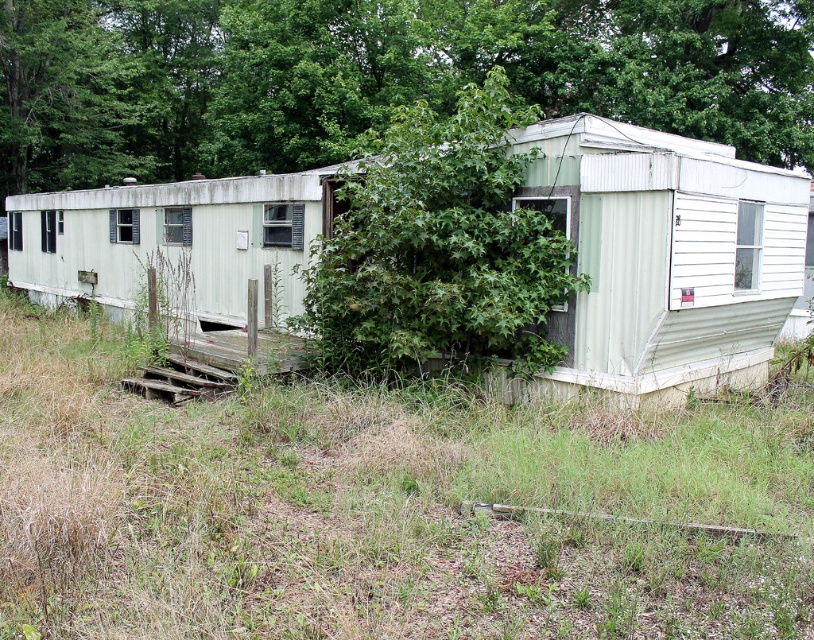
Looking at this image, does green leafy tree at upper center lie in front of green leafy tree at center?

No, it is not.

Between green leafy tree at upper center and green leafy tree at center, which one appears on the left side from the viewer's perspective?

Positioned to the left is green leafy tree at upper center.

What do you see at coordinates (374, 76) in the screenshot? I see `green leafy tree at upper center` at bounding box center [374, 76].

Find the location of a particular element. This screenshot has width=814, height=640. green leafy tree at upper center is located at coordinates (374, 76).

Is green grass at lower center positioned in front of green leafy tree at upper center?

Yes, green grass at lower center is closer to the viewer.

Does green grass at lower center have a lesser width compared to green leafy tree at upper center?

Correct, green grass at lower center's width is less than green leafy tree at upper center's.

Between point (561, 424) and point (99, 72), which one is positioned behind?

The point (99, 72) is more distant.

Image resolution: width=814 pixels, height=640 pixels. Identify the location of green grass at lower center. (379, 508).

Based on the photo, who is lower down, green corrugated metal mobile home at center or green leafy tree at center?

green leafy tree at center

Which is behind, point (165, 257) or point (335, 362)?

The point (165, 257) is behind.

Locate an element on the screen. The height and width of the screenshot is (640, 814). green corrugated metal mobile home at center is located at coordinates (664, 253).